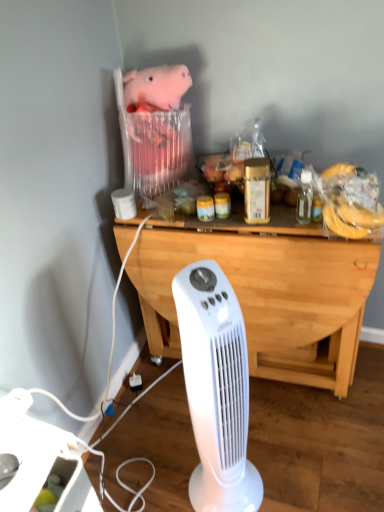
Question: Do you think clear glass bottle at upper right is within white plastic fan at center, or outside of it?

Choices:
 (A) outside
 (B) inside

Answer: (A)

Question: From a real-world perspective, is clear glass bottle at upper right positioned above or below white plastic fan at center?

Choices:
 (A) below
 (B) above

Answer: (B)

Question: Estimate the real-world distances between objects in this image. Which object is farther from the pink plush toy at upper center?

Choices:
 (A) white plastic power strip at lower left
 (B) light wood/dark brown desk at center
 (C) white plastic fan at center
 (D) clear glass bottle at upper right

Answer: (A)

Question: Which object is positioned farthest from the clear glass bottle at upper right?

Choices:
 (A) white plastic fan at center
 (B) light wood/dark brown desk at center
 (C) white plastic power strip at lower left
 (D) pink plush toy at upper center

Answer: (C)